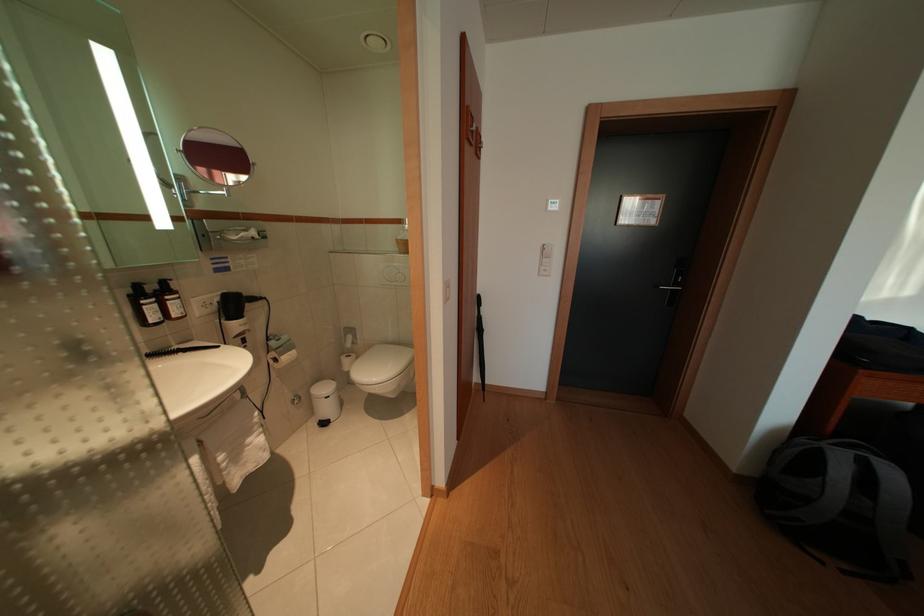
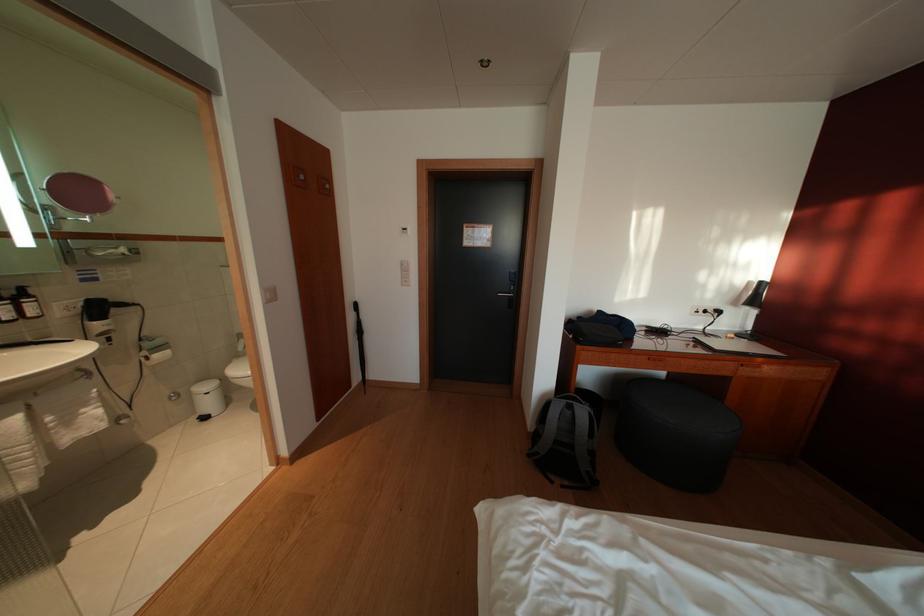
Question: The camera is either moving clockwise (left) or counter-clockwise (right) around the object. The first image is from the beginning of the video and the second image is from the end. Is the camera moving left or right when shooting the video?

Choices:
 (A) Left
 (B) Right

Answer: (A)